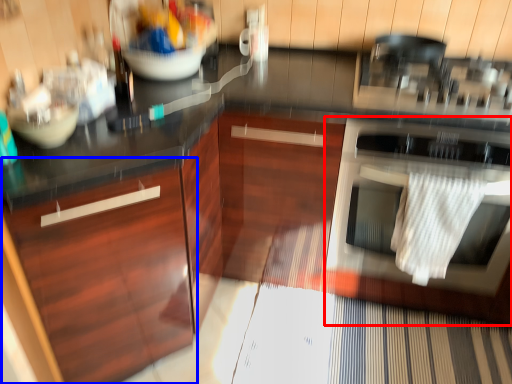
Question: Which point is closer to the camera, home appliance (highlighted by a red box) or cabinetry (highlighted by a blue box)?

Choices:
 (A) home appliance
 (B) cabinetry

Answer: (B)